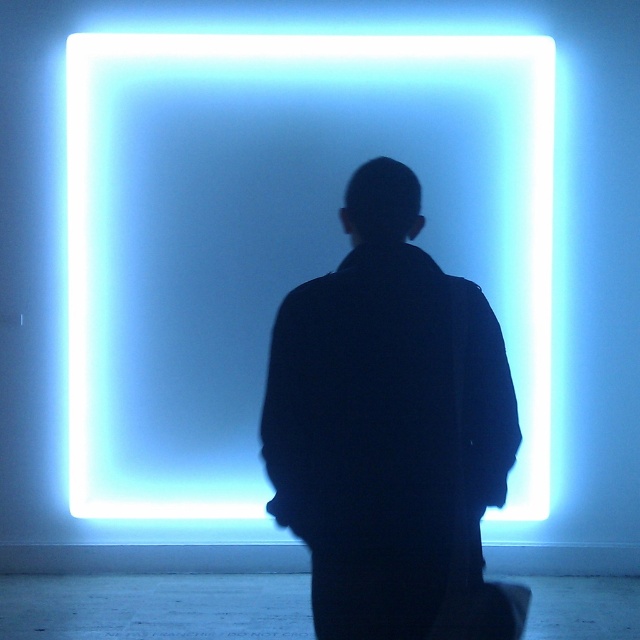
Looking at this image, is blue neon square at center closer to the viewer compared to black matte jacket at center?

No, blue neon square at center is further to the viewer.

Between point (515, 49) and point (422, 570), which one is positioned behind?

The point (515, 49) is behind.

Between point (227, 481) and point (477, 346), which one is positioned in front?

Point (477, 346) is in front.

Image resolution: width=640 pixels, height=640 pixels. Find the location of `blue neon square at center`. blue neon square at center is located at coordinates (276, 234).